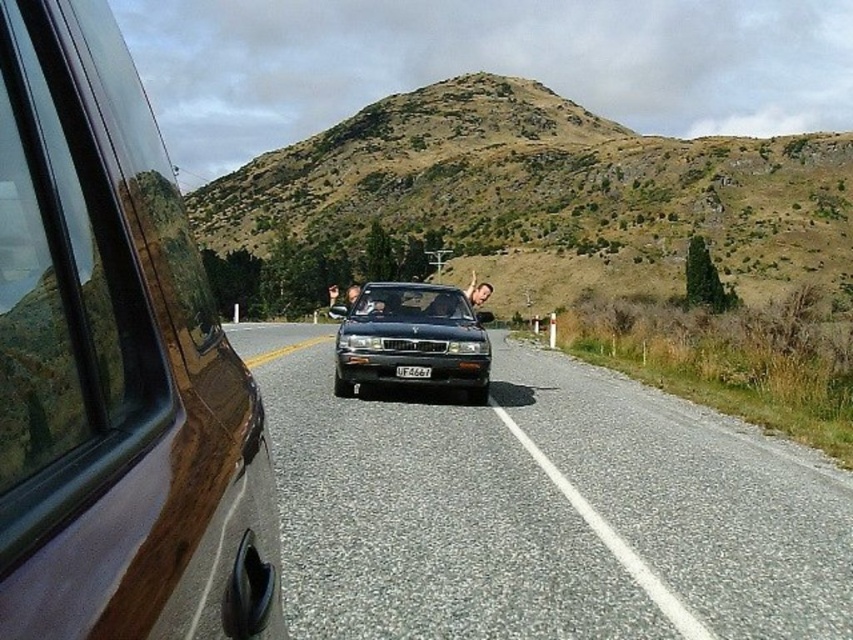
You are a driver approaching a curve on the road. You notice a brown grassy hill at upper center and a black glossy sedan at center ahead. Which object will appear wider from your perspective?

The brown grassy hill at upper center will appear wider because its width is larger than the black glossy sedan at center.

You are a passenger in a car and notice the black asphalt road at center and the brown grassy hill at upper center outside the window. Which object is positioned to the left when looking forward?

The black asphalt road at center is to the left of brown grassy hill at upper center, so the black asphalt road at center is positioned to the left when looking forward.

You are a passenger in a car and looking out the window. You see a brown grassy hill at upper center and a black glossy sedan at center. Which object is closer to your vehicle?

The black glossy sedan at center is behind the brown grassy hill at upper center, so the brown grassy hill at upper center is closer to your vehicle.